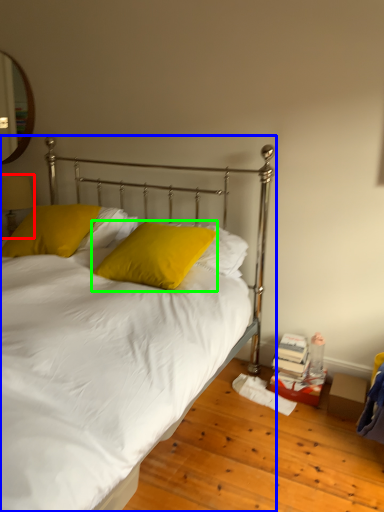
Question: Considering the real-world distances, which object is closest to table lamp (highlighted by a red box)? bed (highlighted by a blue box) or pillow (highlighted by a green box).

Choices:
 (A) bed
 (B) pillow

Answer: (A)